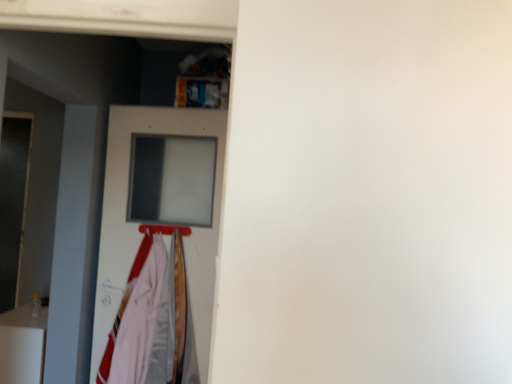
Question: Could you tell me if white fabric at left is turned towards white glossy fridge at lower left?

Choices:
 (A) yes
 (B) no

Answer: (B)

Question: Is white fabric at left in contact with white glossy fridge at lower left?

Choices:
 (A) no
 (B) yes

Answer: (A)

Question: Is white fabric at left surrounding white glossy fridge at lower left?

Choices:
 (A) no
 (B) yes

Answer: (A)

Question: Is white fabric at left looking in the opposite direction of white glossy fridge at lower left?

Choices:
 (A) yes
 (B) no

Answer: (B)

Question: Can you confirm if white fabric at left is taller than white glossy fridge at lower left?

Choices:
 (A) no
 (B) yes

Answer: (B)

Question: From a real-world perspective, is white fabric at left positioned above or below metallic silver hanger at center?

Choices:
 (A) above
 (B) below

Answer: (B)

Question: Is point (108, 339) closer or farther from the camera than point (169, 231)?

Choices:
 (A) closer
 (B) farther

Answer: (A)

Question: From the image's perspective, relative to metallic silver hanger at center, is white fabric at left above or below?

Choices:
 (A) below
 (B) above

Answer: (A)

Question: Is white fabric at left situated inside metallic silver hanger at center or outside?

Choices:
 (A) inside
 (B) outside

Answer: (B)

Question: Considering the positions of metallic silver hanger at center and white glossy fridge at lower left in the image, is metallic silver hanger at center wider or thinner than white glossy fridge at lower left?

Choices:
 (A) thin
 (B) wide

Answer: (A)

Question: From the image's perspective, relative to white glossy fridge at lower left, is metallic silver hanger at center above or below?

Choices:
 (A) below
 (B) above

Answer: (B)

Question: Visually, is metallic silver hanger at center positioned to the left or to the right of white glossy fridge at lower left?

Choices:
 (A) left
 (B) right

Answer: (B)

Question: In terms of size, does metallic silver hanger at center appear bigger or smaller than white glossy fridge at lower left?

Choices:
 (A) small
 (B) big

Answer: (A)

Question: From a real-world perspective, is metallic silver hanger at center above or below white matte door at center?

Choices:
 (A) below
 (B) above

Answer: (B)

Question: Do you think metallic silver hanger at center is within white matte door at center, or outside of it?

Choices:
 (A) inside
 (B) outside

Answer: (B)